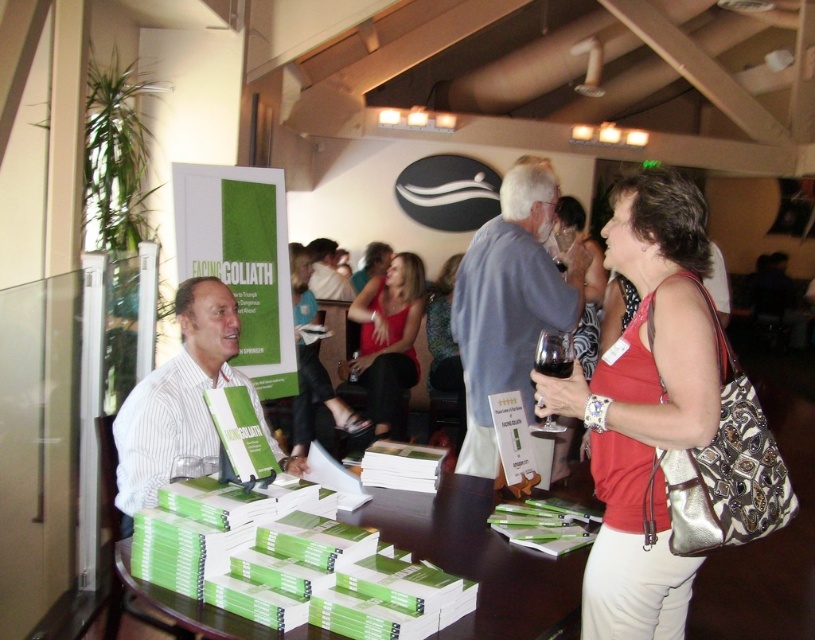
You are an attendee at the event and want to hand your book to the author. The green paper book at center is on the table. Where should you place your hand to reach the book without moving the red fabric tank top at center?

Place your hand on the left side of the green paper book at center since the red fabric tank top at center is to its right, leaving space on the left to grasp the book without disturbing the tank top.